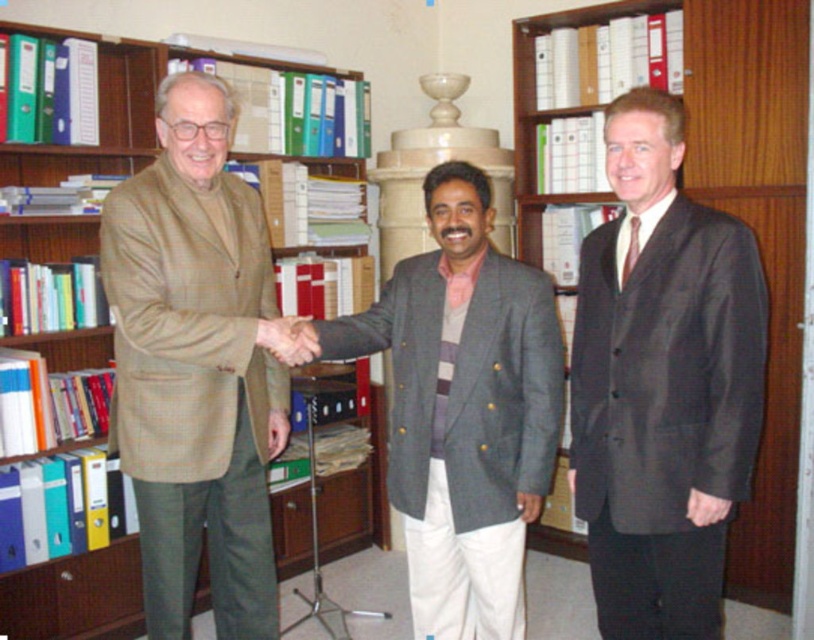
Does beige woolen coat at left have a lesser width compared to brown leather hand at center?

Incorrect, beige woolen coat at left's width is not less than brown leather hand at center's.

Between point (228, 404) and point (287, 358), which one is positioned behind?

The point (228, 404) is behind.

Image resolution: width=814 pixels, height=640 pixels. What do you see at coordinates (195, 368) in the screenshot? I see `beige woolen coat at left` at bounding box center [195, 368].

Locate an element on the screen. The height and width of the screenshot is (640, 814). beige woolen coat at left is located at coordinates (195, 368).

Does dark gray suit at center appear on the right side of beige woolen coat at left?

Indeed, dark gray suit at center is positioned on the right side of beige woolen coat at left.

Is dark gray suit at center positioned before beige woolen coat at left?

Yes, it is in front of beige woolen coat at left.

Is point (615, 612) positioned in front of point (239, 433)?

Yes, point (615, 612) is closer to viewer.

Image resolution: width=814 pixels, height=640 pixels. I want to click on dark gray suit at center, so click(x=662, y=384).

Based on the photo, can you confirm if dark gray suit at center is positioned below gray woolen blazer at center?

Actually, dark gray suit at center is above gray woolen blazer at center.

Is dark gray suit at center further to the viewer compared to gray woolen blazer at center?

No, it is in front of gray woolen blazer at center.

Between point (631, 364) and point (449, 392), which one is positioned behind?

Positioned behind is point (449, 392).

The image size is (814, 640). Find the location of `dark gray suit at center`. dark gray suit at center is located at coordinates (662, 384).